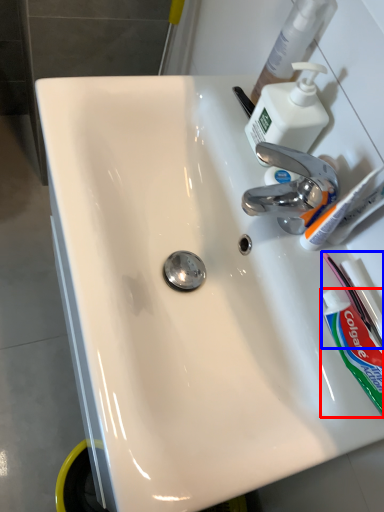
Question: Which of the following is the farthest to the observer, toothpaste (highlighted by a red box) or toothbrush (highlighted by a blue box)?

Choices:
 (A) toothpaste
 (B) toothbrush

Answer: (B)